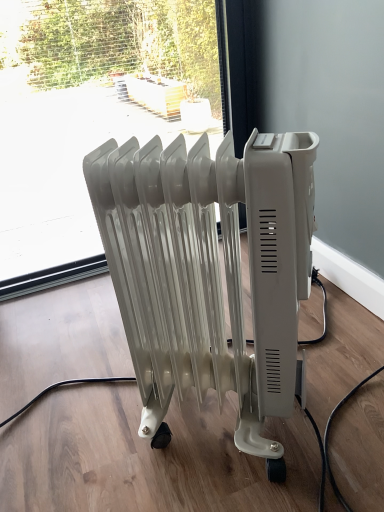
What is the approximate height of white plastic radiator at center?

white plastic radiator at center is 56.15 centimeters tall.

The image size is (384, 512). What do you see at coordinates (205, 272) in the screenshot?
I see `white plastic radiator at center` at bounding box center [205, 272].

The image size is (384, 512). Identify the location of white plastic radiator at center. (205, 272).

Measure the distance between point (x=289, y=399) and camera.

A distance of 28.46 inches exists between point (x=289, y=399) and camera.

Describe the element at coordinates (96, 117) in the screenshot. This screenshot has width=384, height=512. I see `transparent glass window at center` at that location.

The height and width of the screenshot is (512, 384). Identify the location of transparent glass window at center. (96, 117).

Find the location of `white plastic radiator at center`. white plastic radiator at center is located at coordinates (205, 272).

Based on their positions, is transparent glass window at center located to the left or right of white plastic radiator at center?

In the image, transparent glass window at center appears on the left side of white plastic radiator at center.

Does transparent glass window at center lie behind white plastic radiator at center?

Yes, transparent glass window at center is behind white plastic radiator at center.

Considering the points (5, 56) and (296, 348), which point is in front, point (5, 56) or point (296, 348)?

The point (296, 348) is more forward.

From the image's perspective, between transparent glass window at center and white plastic radiator at center, who is located below?

From the image's view, white plastic radiator at center is below.

In the scene shown: From a real-world perspective, is transparent glass window at center positioned under white plastic radiator at center based on gravity?

No, from a real-world perspective, transparent glass window at center is not below white plastic radiator at center.

Can you confirm if transparent glass window at center is thinner than white plastic radiator at center?

Yes, transparent glass window at center is thinner than white plastic radiator at center.

From their relative heights in the image, would you say transparent glass window at center is taller or shorter than white plastic radiator at center?

In the image, transparent glass window at center appears to be taller than white plastic radiator at center.

Is transparent glass window at center smaller than white plastic radiator at center?

No.

Can white plastic radiator at center be found inside transparent glass window at center?

Answer: No.

Is transparent glass window at center next to white plastic radiator at center?

No, transparent glass window at center is not in contact with white plastic radiator at center.

Is transparent glass window at center positioned with its back to white plastic radiator at center?

That's not correct — transparent glass window at center is not looking away from white plastic radiator at center.

How many degrees apart are the facing directions of transparent glass window at center and white plastic radiator at center?

32.1 degrees.

Locate an element on the screen. This screenshot has width=384, height=512. window above the white plastic radiator at center (from the image's perspective) is located at coordinates (96, 117).

Between white plastic radiator at center and transparent glass window at center, which one appears on the right side from the viewer's perspective?

From the viewer's perspective, white plastic radiator at center appears more on the right side.

Is white plastic radiator at center closer to the viewer compared to transparent glass window at center?

Yes, white plastic radiator at center is closer to the viewer.

Is point (225, 185) behind point (1, 182)?

That is False.

From the image's perspective, between white plastic radiator at center and transparent glass window at center, who is located below?

white plastic radiator at center, from the image's perspective.

From a real-world perspective, between white plastic radiator at center and transparent glass window at center, who is vertically higher?

transparent glass window at center is physically above.

Is white plastic radiator at center thinner than transparent glass window at center?

No.

Considering the relative sizes of white plastic radiator at center and transparent glass window at center in the image provided, is white plastic radiator at center taller than transparent glass window at center?

No.

Which of these two, white plastic radiator at center or transparent glass window at center, is smaller?

Smaller between the two is white plastic radiator at center.

Is white plastic radiator at center outside of transparent glass window at center?

Yes.

Is white plastic radiator at center far from transparent glass window at center?

Yes, white plastic radiator at center is far from transparent glass window at center.

Is white plastic radiator at center oriented away from transparent glass window at center?

Yes, transparent glass window at center is at the back of white plastic radiator at center.

How many degrees apart are the facing directions of white plastic radiator at center and transparent glass window at center?

There is a 32.1-degree angle between the facing directions of white plastic radiator at center and transparent glass window at center.

How much distance is there between white plastic radiator at center and transparent glass window at center?

white plastic radiator at center is 1.31 meters away from transparent glass window at center.

At what (x,y) coordinates should I click in order to perform the action: click on bath heater below the transparent glass window at center (from a real-world perspective). Please return your answer as a coordinate pair (x, y). The width and height of the screenshot is (384, 512). Looking at the image, I should click on (205, 272).

What are the coordinates of `window on the left of white plastic radiator at center` in the screenshot? It's located at (96, 117).

The width and height of the screenshot is (384, 512). In the image, there is a transparent glass window at center. What are the coordinates of `bath heater below it (from the image's perspective)` in the screenshot? It's located at (205, 272).